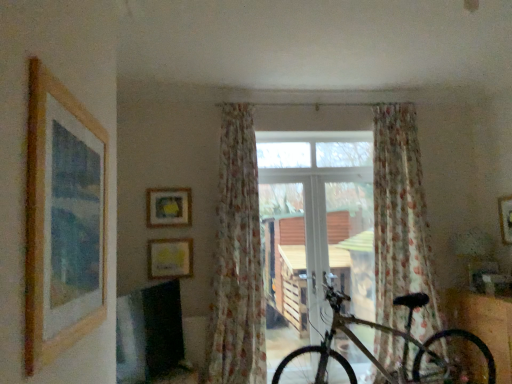
Question: From a real-world perspective, is floral sheer curtain at center, which is the 2th curtain from left to right, positioned above or below white plastic window at center?

Choices:
 (A) above
 (B) below

Answer: (A)

Question: Considering their positions, is floral sheer curtain at center, the 1th curtain when ordered from right to left, located in front of or behind white plastic window at center?

Choices:
 (A) front
 (B) behind

Answer: (A)

Question: Which object is the closest to the matte yellow picture frame at upper center, arranged as the fourth picture frame when viewed from the front?

Choices:
 (A) wooden picture frame at left, placed as the 3th picture frame when sorted from left to right
 (B) gold metallic bicycle at center
 (C) metallic silver bicycle at lower right
 (D) floral sheer curtain at center, which is the 2th curtain from left to right
 (E) wooden picture frame at right, which is the 2th picture frame from front to back

Answer: (B)

Question: Which is farther from the floral sheer curtain at center, the 2th curtain when ordered from right to left?

Choices:
 (A) wooden picture frame at left, placed as the 3th picture frame when sorted from left to right
 (B) matte yellow picture frame at upper center, arranged as the first picture frame when viewed from the back
 (C) white plastic window at center
 (D) yellow paper at upper center, the 3th picture frame in the front-to-back sequence
 (E) floral sheer curtain at center, which is the 2th curtain from left to right

Answer: (A)